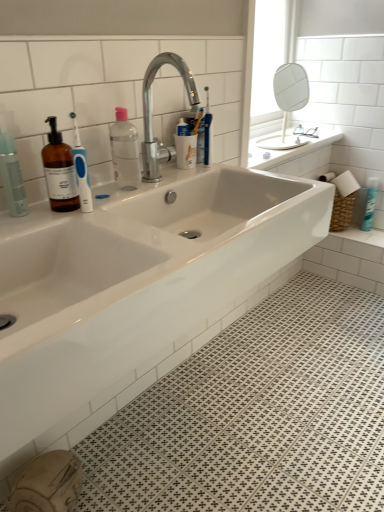
Find the location of `vacant space underneath chrome metallic faucet at upper center (from a real-world perspective)`. vacant space underneath chrome metallic faucet at upper center (from a real-world perspective) is located at coordinates (179, 175).